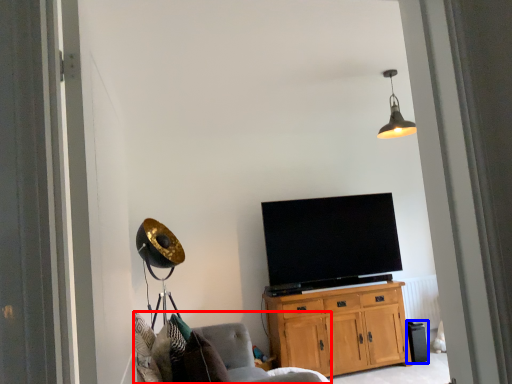
Question: Which of the following is the farthest to the observer, chair (highlighted by a red box) or trash bin/can (highlighted by a blue box)?

Choices:
 (A) chair
 (B) trash bin/can

Answer: (B)